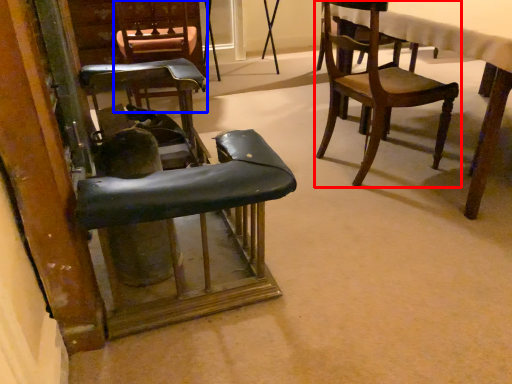
Question: Which object appears closest to the camera in this image, chair (highlighted by a red box) or chair (highlighted by a blue box)?

Choices:
 (A) chair
 (B) chair

Answer: (A)